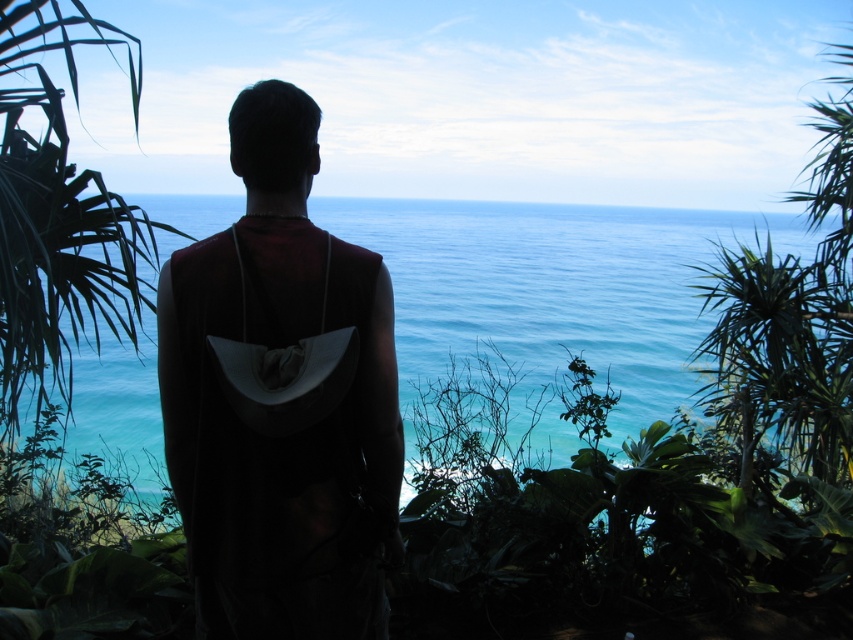
You are a hiker who just reached the cliff edge. You have a dark fabric backpack at center and blue water at center in front of you. Which object is on the left side when facing the ocean?

The dark fabric backpack at center is positioned on the left side of blue water at center, so when facing the ocean, the dark fabric backpack at center would be on your left side.